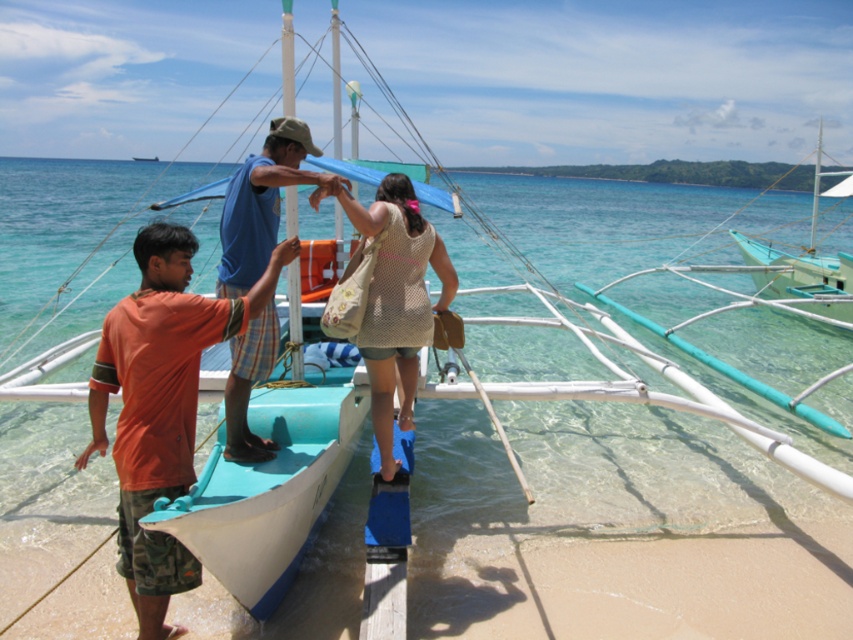
Which is more to the left, beige crochet bag at center or teal wooden boat at right?

Positioned to the left is beige crochet bag at center.

Describe the element at coordinates (395, 300) in the screenshot. I see `beige crochet bag at center` at that location.

Locate an element on the screen. Image resolution: width=853 pixels, height=640 pixels. beige crochet bag at center is located at coordinates (395, 300).

Between beige crochet bag at center and blue plaid shorts at center, which one has more height?

blue plaid shorts at center is taller.

What do you see at coordinates (395, 300) in the screenshot? This screenshot has height=640, width=853. I see `beige crochet bag at center` at bounding box center [395, 300].

The image size is (853, 640). Find the location of `beige crochet bag at center`. beige crochet bag at center is located at coordinates (395, 300).

The height and width of the screenshot is (640, 853). Identify the location of beige crochet bag at center. (395, 300).

Can you confirm if orange cotton shirt at center is wider than teal wooden boat at right?

No, orange cotton shirt at center is not wider than teal wooden boat at right.

Does orange cotton shirt at center appear over teal wooden boat at right?

Actually, orange cotton shirt at center is below teal wooden boat at right.

Does point (164, 291) come closer to viewer compared to point (764, 284)?

Yes.

Find the location of `orange cotton shirt at center`. orange cotton shirt at center is located at coordinates (161, 403).